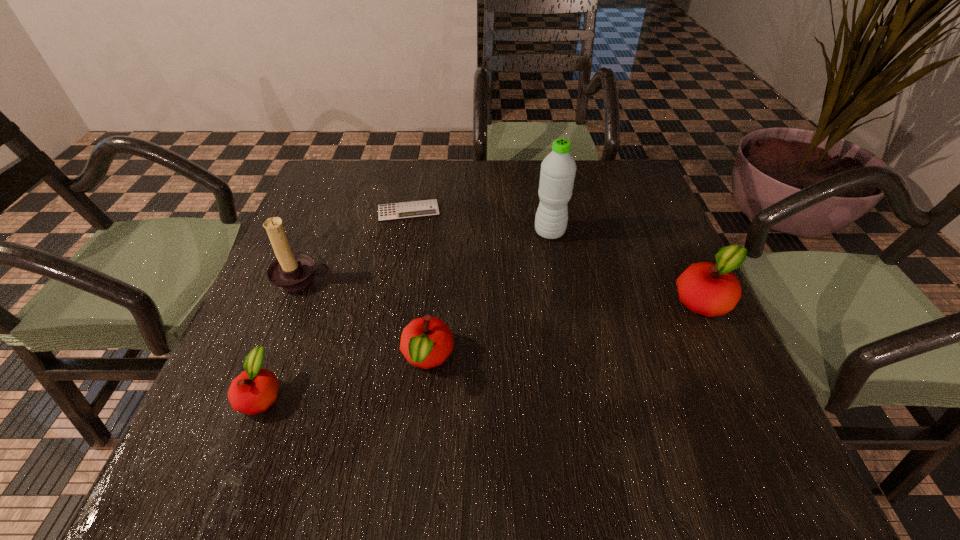
Identify the location of the shortest apple. This screenshot has width=960, height=540. (253, 391).

The height and width of the screenshot is (540, 960). I want to click on the fifth tallest object, so coord(253,391).

Identify the location of the second tallest apple. The width and height of the screenshot is (960, 540). (426, 342).

The image size is (960, 540). I want to click on the second apple from left to right, so 426,342.

The image size is (960, 540). Find the location of `the tallest apple`. the tallest apple is located at coordinates (709, 289).

At what (x,y) coordinates should I click in order to perform the action: click on the farthest apple. Please return your answer as a coordinate pair (x, y). The height and width of the screenshot is (540, 960). Looking at the image, I should click on (709, 289).

I want to click on the farthest object, so click(x=426, y=208).

This screenshot has width=960, height=540. I want to click on calculator, so click(x=426, y=208).

The height and width of the screenshot is (540, 960). What are the coordinates of `the second tallest object` in the screenshot? It's located at (290, 272).

I want to click on the second farthest object, so click(558, 169).